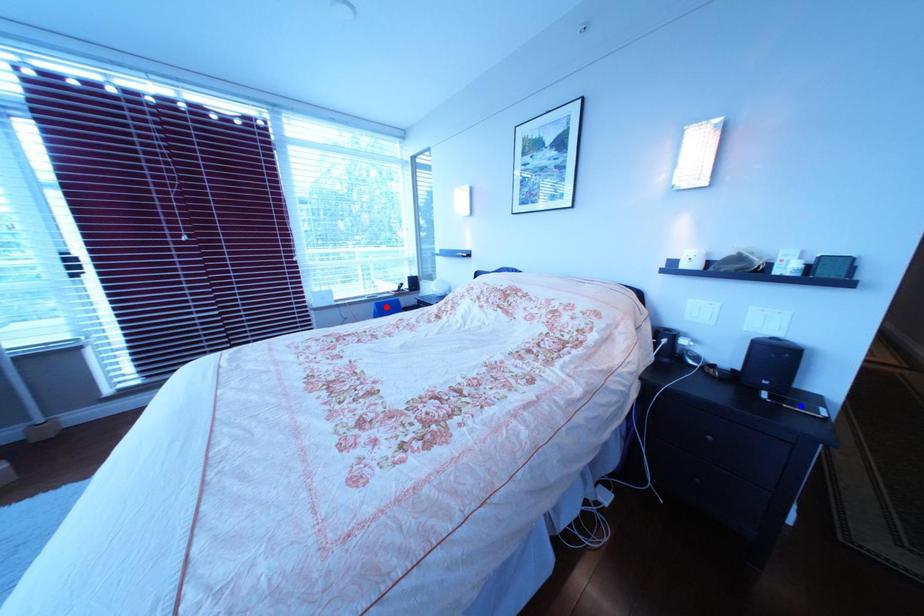
Question: In the image, two points are highlighted. Which point is nearer to the camera? Reply with the corresponding letter.

Choices:
 (A) blue point
 (B) red point

Answer: (A)